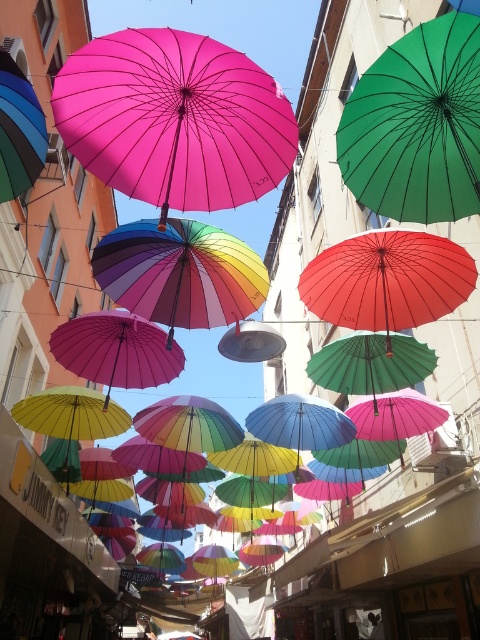
In the scene shown: Does pink matte umbrella at upper center have a lesser height compared to rainbow fabric umbrella at center?

No.

At what (x,y) coordinates should I click in order to perform the action: click on pink matte umbrella at upper center. Please return your answer as a coordinate pair (x, y). The height and width of the screenshot is (640, 480). Looking at the image, I should click on (175, 120).

The height and width of the screenshot is (640, 480). Describe the element at coordinates (175, 120) in the screenshot. I see `pink matte umbrella at upper center` at that location.

Is pink matte umbrella at upper center behind red matte umbrella at center?

No.

Which is in front, point (220, 106) or point (337, 257)?

Point (220, 106) is in front.

The height and width of the screenshot is (640, 480). I want to click on pink matte umbrella at upper center, so pos(175,120).

Is rainbow fabric umbrella at center thinner than red matte umbrella at center?

Correct, rainbow fabric umbrella at center's width is less than red matte umbrella at center's.

Is point (135, 280) positioned before point (393, 280)?

Yes, it is.

The height and width of the screenshot is (640, 480). In order to click on rainbow fabric umbrella at center in this screenshot , I will do `click(180, 273)`.